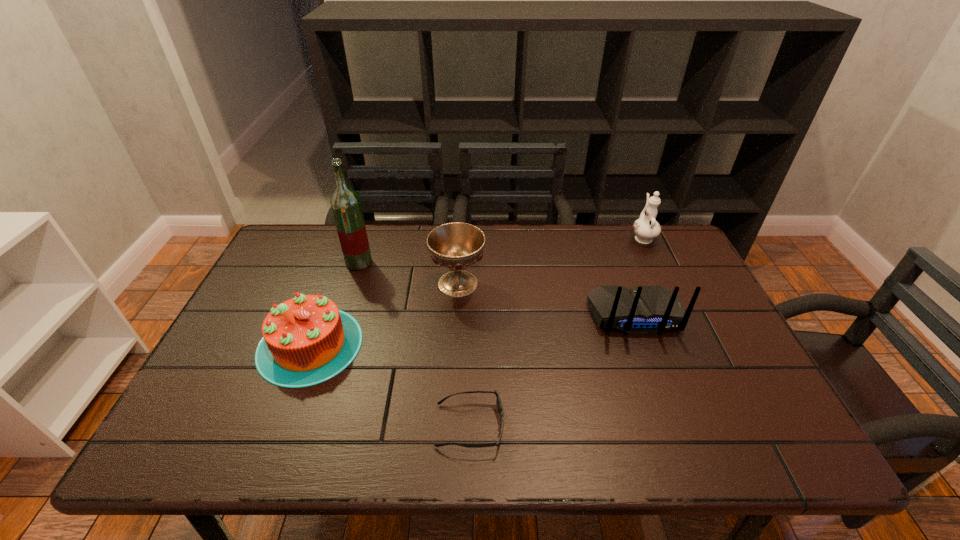
This screenshot has width=960, height=540. Find the location of `liquor`. liquor is located at coordinates (345, 203).

Where is `the farthest object`? The width and height of the screenshot is (960, 540). the farthest object is located at coordinates (646, 228).

The height and width of the screenshot is (540, 960). Identify the location of router. (648, 309).

Where is `chalice`? The height and width of the screenshot is (540, 960). chalice is located at coordinates (456, 246).

This screenshot has width=960, height=540. Find the location of `cake`. cake is located at coordinates (307, 340).

You are a GUI agent. You are given a task and a screenshot of the screen. Output one action in this format:
    pyautogui.click(x=<x>, y=<y>)
    Task: Click on the nearest object
    
    Given the screenshot: What is the action you would take?
    pyautogui.click(x=498, y=401)

The height and width of the screenshot is (540, 960). I want to click on sunglasses, so click(498, 401).

At what (x,y) coordinates should I click in order to perform the action: click on vacant space situated on the back of the tallest object. Please return your answer as a coordinate pair (x, y). Looking at the image, I should click on click(367, 240).

The height and width of the screenshot is (540, 960). What are the coordinates of `vacant space located on the back of the router` in the screenshot? It's located at (674, 421).

At what (x,y) coordinates should I click in order to perform the action: click on vacant space located on the left of the chalice. Please return your answer as a coordinate pair (x, y). This screenshot has width=960, height=540. Looking at the image, I should click on (366, 284).